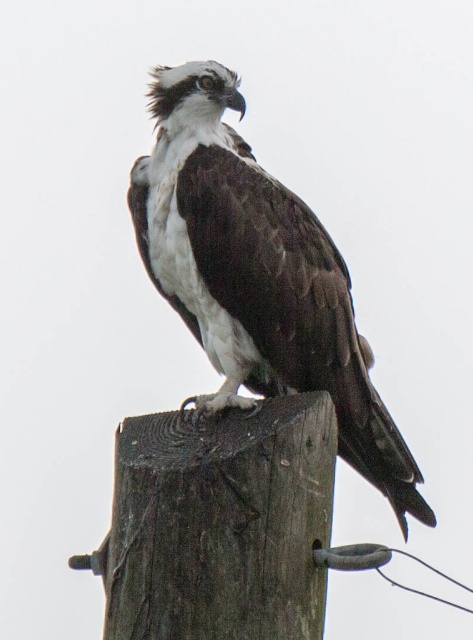
Question: Which of the following is the farthest from the observer?

Choices:
 (A) (343, 262)
 (B) (259, 422)

Answer: (A)

Question: Can you confirm if brown/white feathered bird at center is bigger than brown wood post at upper center?

Choices:
 (A) no
 (B) yes

Answer: (B)

Question: Is brown/white feathered bird at center to the right of brown wood post at upper center from the viewer's perspective?

Choices:
 (A) yes
 (B) no

Answer: (A)

Question: Which of the following is the farthest from the observer?

Choices:
 (A) (254, 330)
 (B) (129, 538)

Answer: (A)

Question: Is brown/white feathered bird at center smaller than brown wood post at upper center?

Choices:
 (A) no
 (B) yes

Answer: (A)